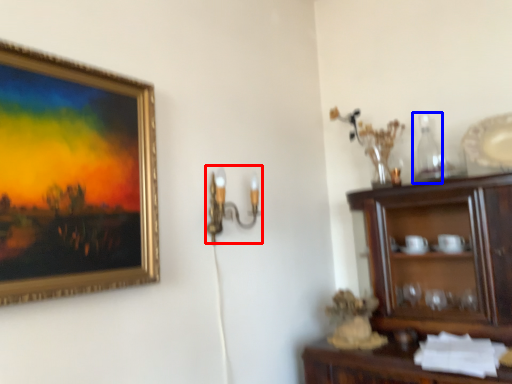
Question: Among these objects, which one is nearest to the camera, candle holder (highlighted by a red box) or bottle (highlighted by a blue box)?

Choices:
 (A) candle holder
 (B) bottle

Answer: (A)